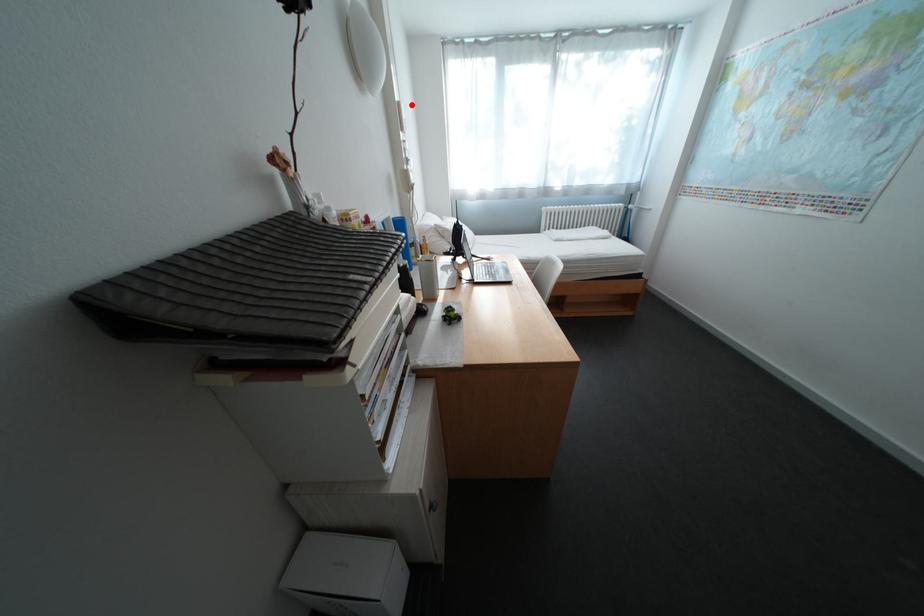
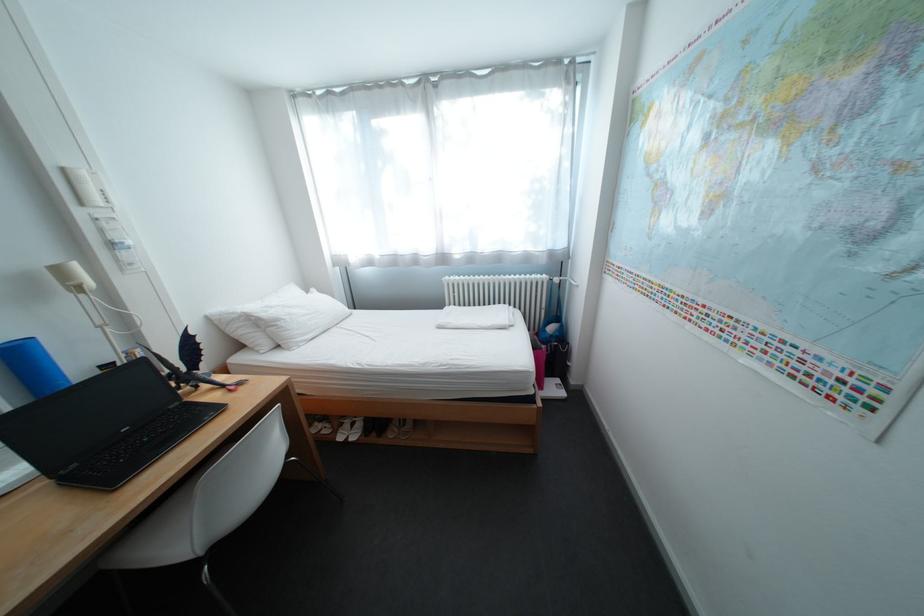
Question: I am providing you with two images of the same scene from different viewpoints. Image1 has a red point marked. In image2, the corresponding 3D location appears at what relative position? Reply with the corresponding letter.

Choices:
 (A) Closer
 (B) Farther

Answer: (B)